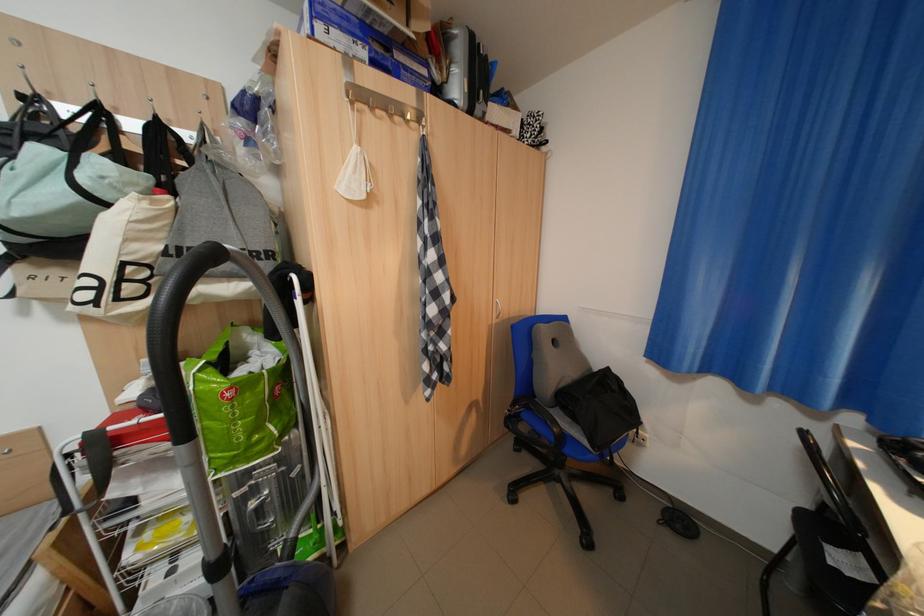
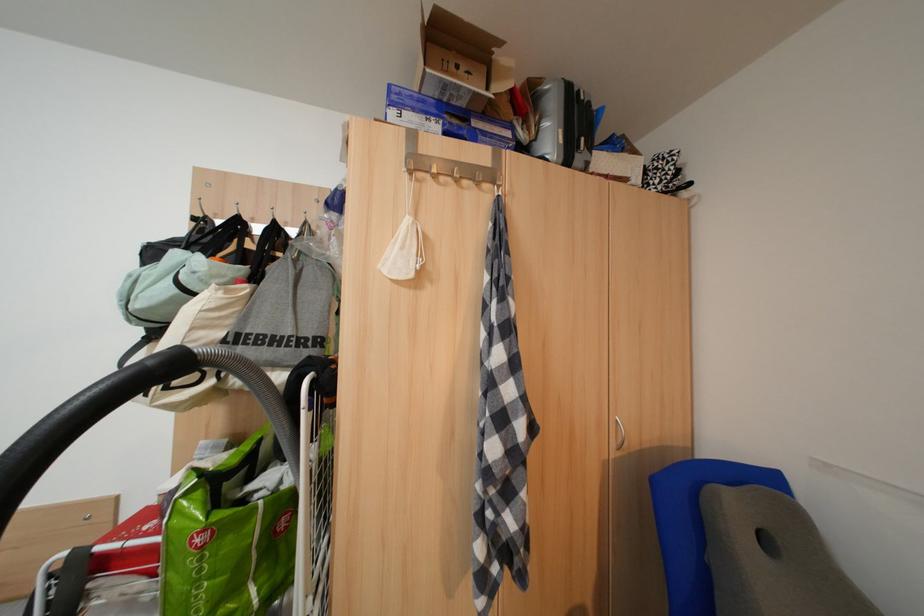
In the second image, find the point that corresponds to the point at 453,71 in the first image.

(541, 130)